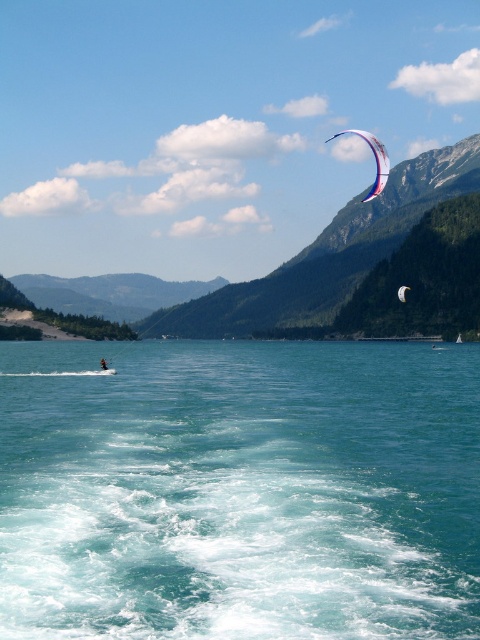
You are a photographer standing on the dock, and you want to capture a photo that includes both the clear blue water at lower center and the white mesh parachute at upper center. Based on their positions, which object should you adjust your camera to focus on first to ensure both are in the frame?

The clear blue water at lower center is to the left of the white mesh parachute at upper center. To include both in the frame, focus on the white mesh parachute at upper center first, then adjust the camera to include the clear blue water at lower center on the left side.

You are a photographer trying to capture a photo of the clear blue water at lower center and the white mesh parachute at upper center. Which object will appear larger in your photo?

The clear blue water at lower center will appear larger in the photo because it is closer to the photographer than the white mesh parachute at upper center.

You are a photographer wanting to capture a shot of the clear blue water at lower center and the white mesh parachute at upper center. Based on their positions, which object is closer to the camera?

The clear blue water at lower center is positioned under the white mesh parachute at upper center, so the white mesh parachute at upper center is closer to the camera.